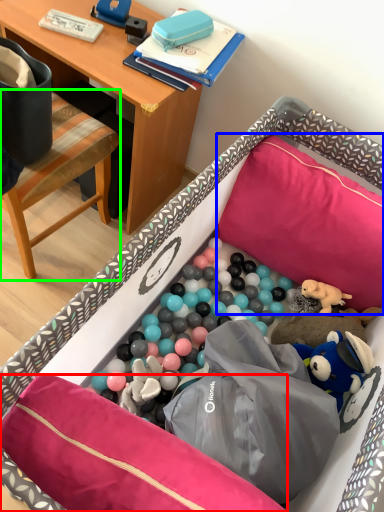
Question: Considering the real-world distances, which object is farthest from pillow (highlighted by a red box)? pillow (highlighted by a blue box) or chair (highlighted by a green box)?

Choices:
 (A) pillow
 (B) chair

Answer: (B)